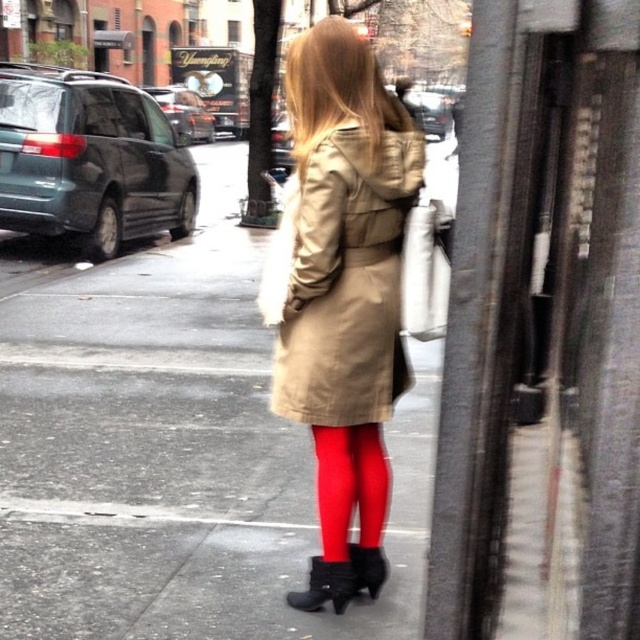
You are a delivery person trying to locate the person wearing the tan fabric coat at center. According to the map, the coat is at coordinates 0.439, 0.534. Can you confirm if this location matches the center of the image?

The tan fabric coat at center is located at coordinates (340,280), which corresponds to the center of the image.

You are standing on the sidewalk in the image and want to reach the point at coordinates (240,324). Considering the wet street and parked cars, can you safely walk straight to that point without stepping on any parked vehicles?

The point at coordinates (240,324) is 22.36 feet away from you. Since the street is wet and has parked cars, but the question specifies walking straight to the point, it depends on whether the path is obstructed. However, the parked cars are along the street, not in the direct path. Assuming the point is on the sidewalk or street away from parked cars, you can walk straight there safely.